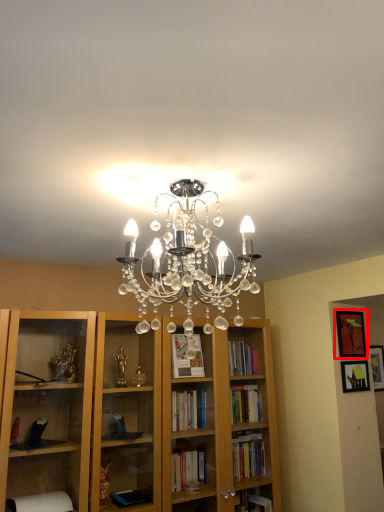
Question: From the image's perspective, what is the correct spatial positioning of picture frame (annotated by the red box) in reference to picture frame?

Choices:
 (A) below
 (B) above

Answer: (B)